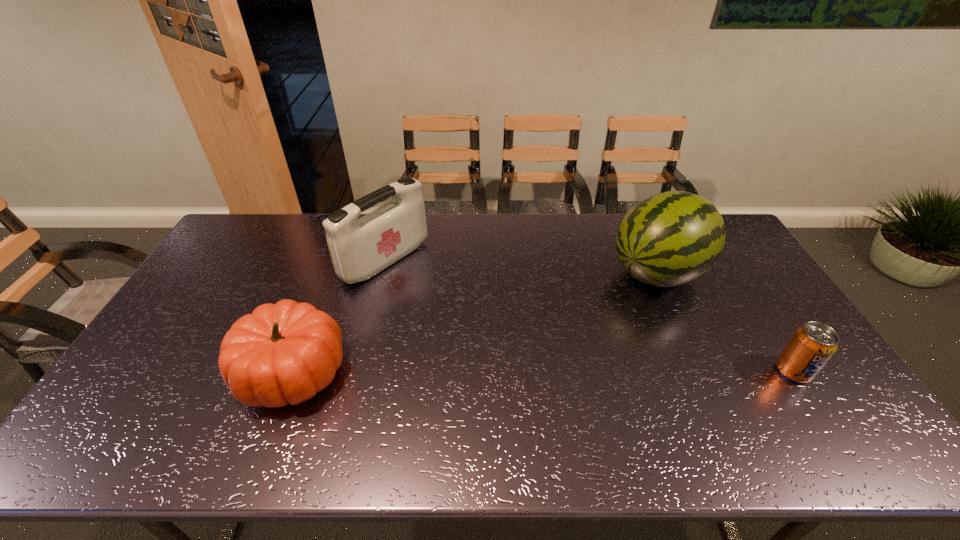
In the image, there is a desktop. Where is `vacant space at the right edge`? vacant space at the right edge is located at coordinates (733, 255).

Locate an element on the screen. This screenshot has height=540, width=960. free space at the far left corner of the desktop is located at coordinates (265, 220).

Where is `empty space that is in between the second shortest object and the first-aid kit`? empty space that is in between the second shortest object and the first-aid kit is located at coordinates (339, 316).

This screenshot has width=960, height=540. In order to click on vacant area between the soda can and the pumpkin in this screenshot , I will do `click(542, 371)`.

Where is `free space between the pumpkin and the first-aid kit`? This screenshot has height=540, width=960. free space between the pumpkin and the first-aid kit is located at coordinates (339, 316).

I want to click on unoccupied position between the second shortest object and the shortest object, so [x=542, y=371].

What are the coordinates of `vacant space that is in between the soda can and the watermelon` in the screenshot? It's located at (726, 322).

You are a GUI agent. You are given a task and a screenshot of the screen. Output one action in this format:
    pyautogui.click(x=<x>, y=<y>)
    Task: Click on the vacant area between the pumpkin and the first-aid kit
    The height and width of the screenshot is (540, 960).
    Given the screenshot: What is the action you would take?
    pyautogui.click(x=339, y=316)

In order to click on free space between the rightmost object and the third object from left to right in this screenshot , I will do `click(726, 322)`.

You are a GUI agent. You are given a task and a screenshot of the screen. Output one action in this format:
    pyautogui.click(x=<x>, y=<y>)
    Task: Click on the empty space that is in between the second shortest object and the first-aid kit
    The height and width of the screenshot is (540, 960).
    Given the screenshot: What is the action you would take?
    pos(339,316)